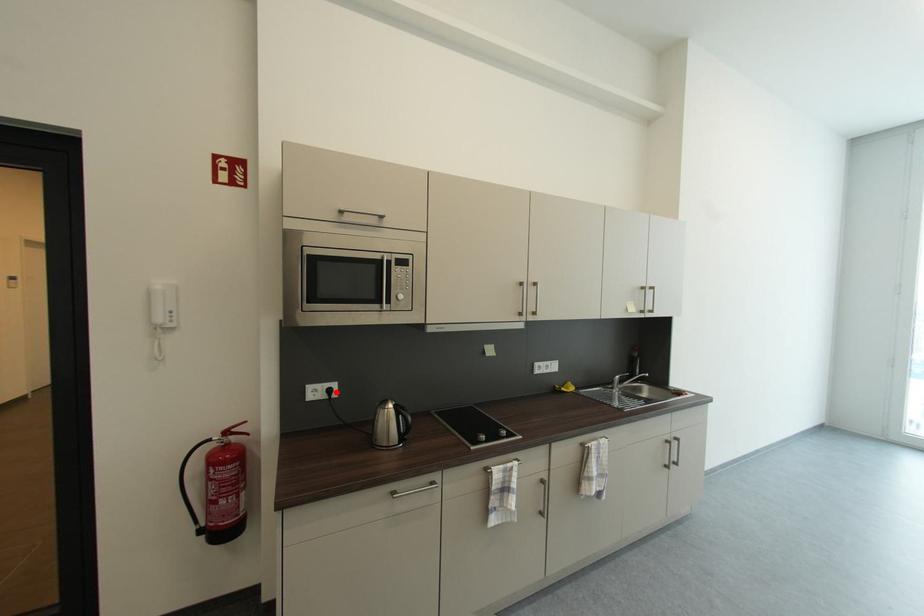
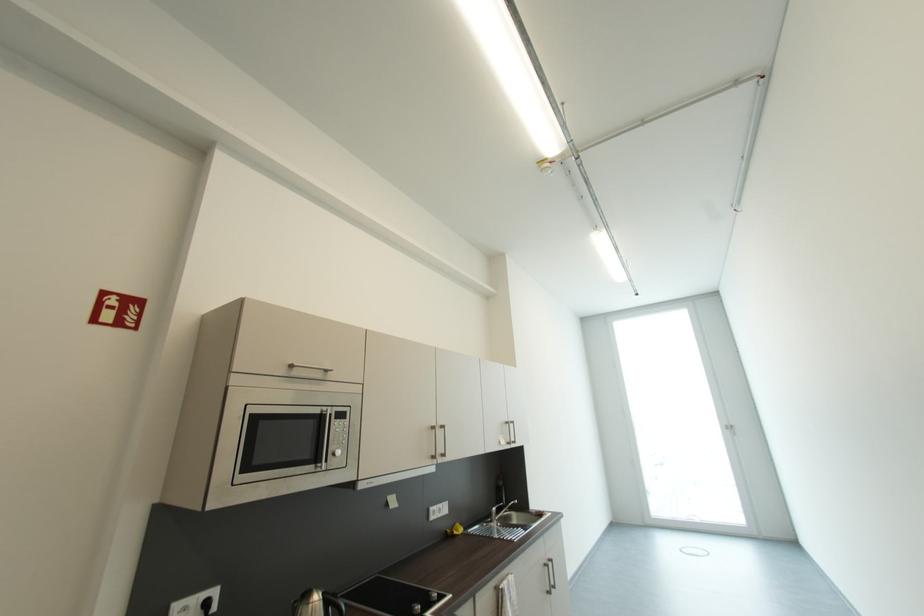
Question: I am providing you with two images of the same scene from different viewpoints. A red point is marked on the first image. At the location where the point appears in image 1, is it still visible in image 2?

Choices:
 (A) Yes
 (B) No

Answer: (A)